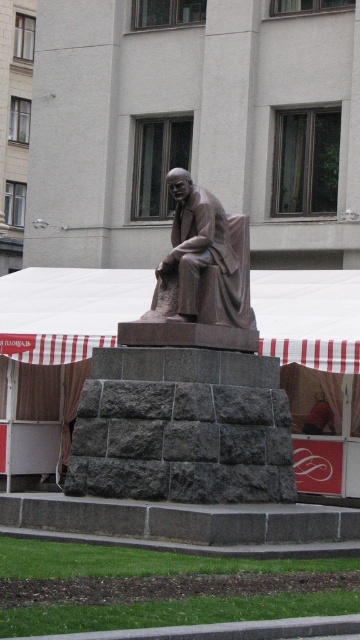
Does bronze statue at center lie behind bronze/statue at center?

No, it is not.

Can you confirm if bronze statue at center is shorter than bronze/statue at center?

In fact, bronze statue at center may be taller than bronze/statue at center.

Image resolution: width=360 pixels, height=640 pixels. I want to click on bronze statue at center, so click(x=187, y=380).

Is bronze statue at center positioned before white striped canopy at center?

Yes, it is.

Can you confirm if bronze statue at center is bigger than white striped canopy at center?

No.

Who is more distant from viewer, (272, 392) or (351, 342)?

Positioned behind is point (351, 342).

The height and width of the screenshot is (640, 360). I want to click on bronze statue at center, so click(x=187, y=380).

Does white striped canopy at center have a lesser width compared to bronze/statue at center?

Incorrect, white striped canopy at center's width is not less than bronze/statue at center's.

Is white striped canopy at center below bronze/statue at center?

Correct, white striped canopy at center is located below bronze/statue at center.

Identify the location of white striped canopy at center. This screenshot has height=640, width=360. (68, 310).

Locate an element on the screen. The height and width of the screenshot is (640, 360). white striped canopy at center is located at coordinates (68, 310).